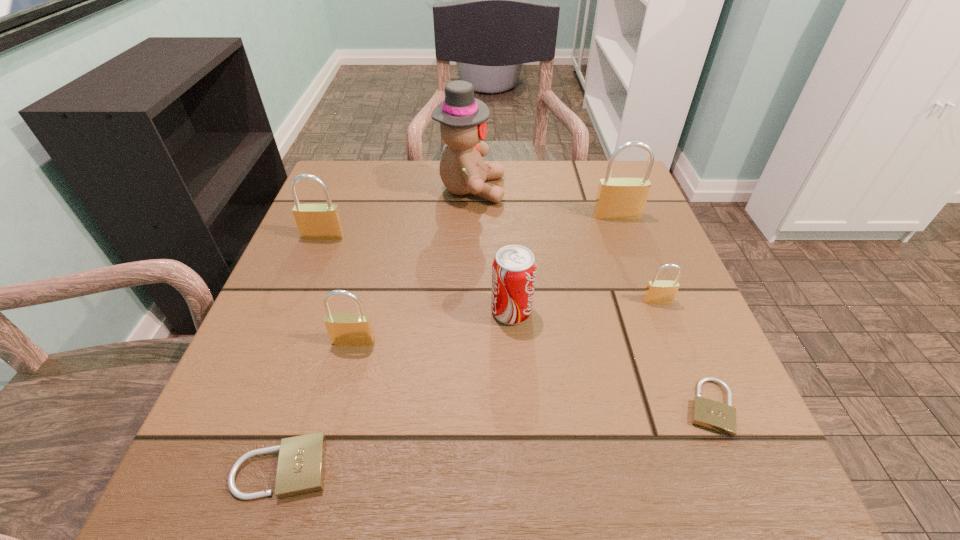
The image size is (960, 540). In order to click on unoccupied area between the third farthest brass padlock and the red soda can in this screenshot , I will do `click(585, 306)`.

I want to click on unoccupied position between the fourth tallest padlock and the smaller beige padlock, so click(x=684, y=354).

Where is `empty space that is in between the red soda can and the third brass padlock from right to left`? Image resolution: width=960 pixels, height=540 pixels. empty space that is in between the red soda can and the third brass padlock from right to left is located at coordinates (433, 326).

Image resolution: width=960 pixels, height=540 pixels. What are the coordinates of `vacant space that is in between the left beige padlock and the fourth farthest padlock` in the screenshot? It's located at (318, 404).

Identify the location of free point between the third brass padlock from right to left and the left beige padlock. Image resolution: width=960 pixels, height=540 pixels. (318, 404).

Identify the location of object that can be found as the second closest to the seventh tallest object. This screenshot has height=540, width=960. (514, 267).

The width and height of the screenshot is (960, 540). Identify the location of object that can be found as the second closest to the farthest brass padlock. (657, 291).

The height and width of the screenshot is (540, 960). Find the location of `the second closest padlock relative to the red soda can`. the second closest padlock relative to the red soda can is located at coordinates (657, 291).

Find the location of a particular element. padlock that is the closest to the fifth tallest padlock is located at coordinates (345, 329).

Locate an element on the screen. brass padlock that can be found as the fourth closest to the left beige padlock is located at coordinates (617, 198).